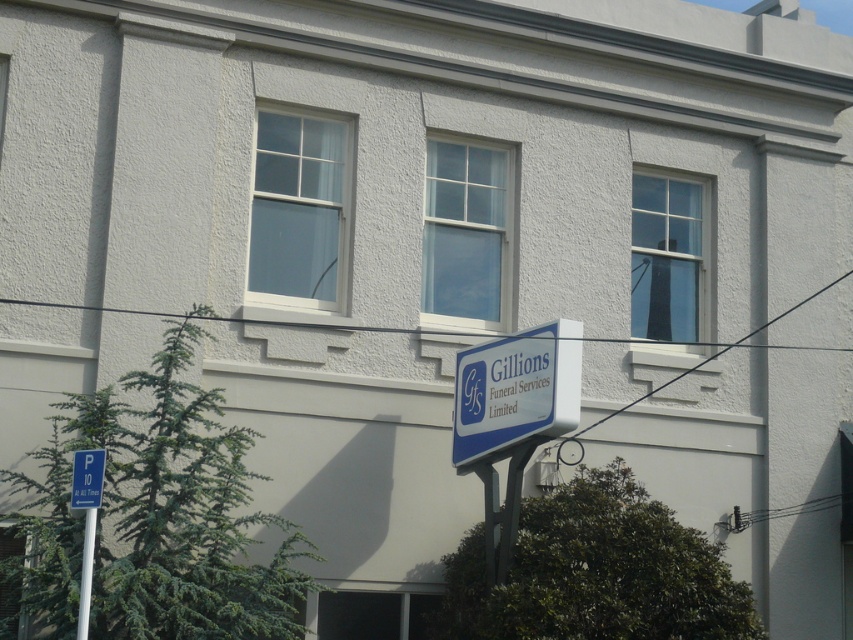
Who is more distant from viewer, (456, 422) or (96, 461)?

The point (456, 422) is more distant.

Measure the distance from blue plastic sign at center to green plastic parking sign at lower left.

They are 3.48 meters apart.

Which is in front, point (479, 378) or point (102, 461)?

Point (102, 461)

Locate an element on the screen. The width and height of the screenshot is (853, 640). blue plastic sign at center is located at coordinates (515, 392).

Can you confirm if green plastic parking sign at lower left is bigger than white plastic pole at lower left?

Correct, green plastic parking sign at lower left is larger in size than white plastic pole at lower left.

Who is higher up, green plastic parking sign at lower left or white plastic pole at lower left?

green plastic parking sign at lower left

The height and width of the screenshot is (640, 853). I want to click on green plastic parking sign at lower left, so tap(86, 477).

Consider the image. Which is above, blue plastic sign at center or white plastic pole at lower left?

blue plastic sign at center is above.

Identify the location of blue plastic sign at center. (515, 392).

This screenshot has width=853, height=640. What are the coordinates of `blue plastic sign at center` in the screenshot? It's located at (515, 392).